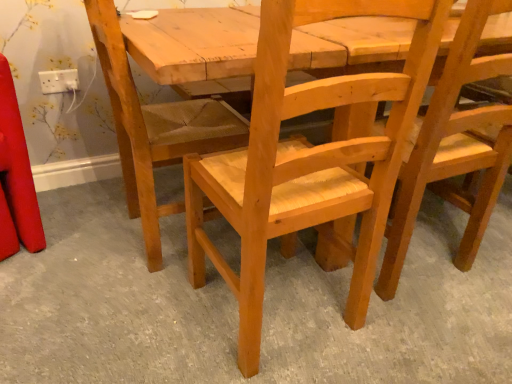
The height and width of the screenshot is (384, 512). Identify the location of free location to the left of natural wood chair at center, which is the second chair in right-to-left order. (139, 320).